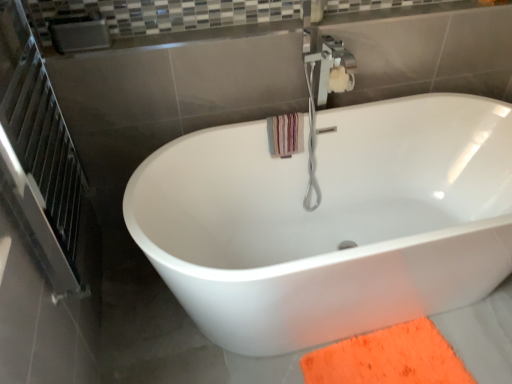
Find the location of a particular element. vacant space in metallic silver screen door at left (from a real-world perspective) is located at coordinates (116, 298).